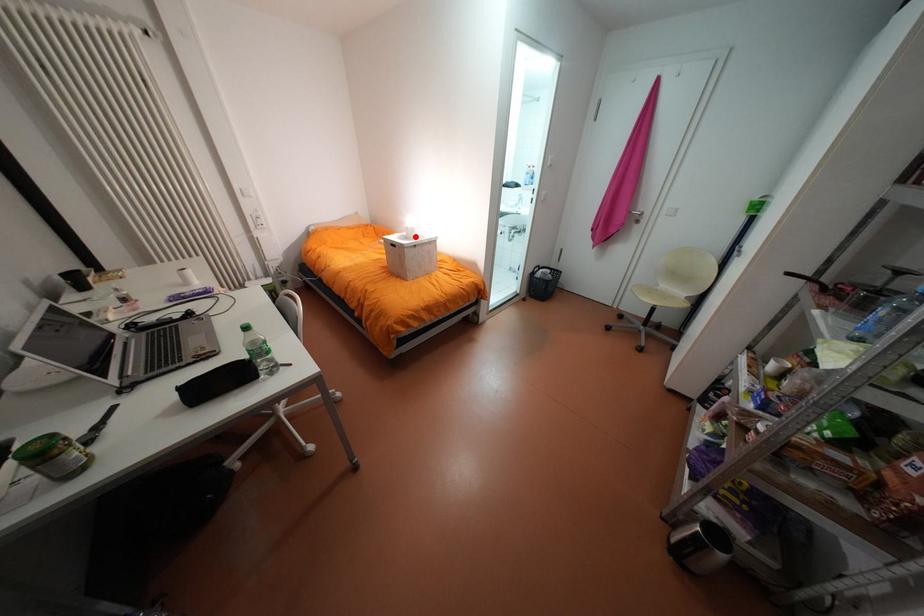
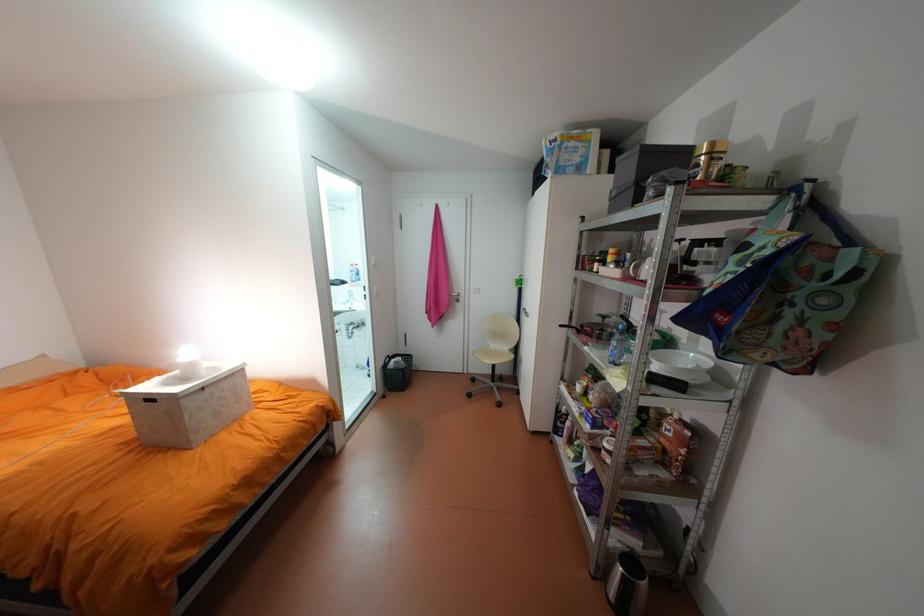
In the second image, find the point that corresponds to the highlighted location in the first image.

(189, 379)